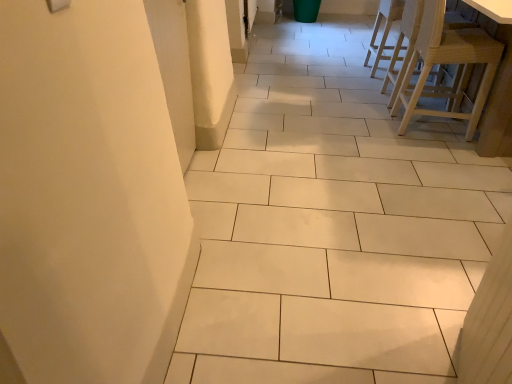
Question: From the image's perspective, is natural wood chair at upper right, the 2th chair when ordered from back to front, located above or below light wood chair at upper right, marked as the 3th chair in a front-to-back arrangement?

Choices:
 (A) below
 (B) above

Answer: (A)

Question: Is natural wood chair at upper right, acting as the second chair starting from the front, taller or shorter than light wood chair at upper right, marked as the 3th chair in a front-to-back arrangement?

Choices:
 (A) short
 (B) tall

Answer: (B)

Question: Estimate the real-world distances between objects in this image. Which object is closer to the light wood stool at right, positioned as the third chair in back-to-front order?

Choices:
 (A) light wood chair at upper right, marked as the 3th chair in a front-to-back arrangement
 (B) natural wood chair at upper right, acting as the second chair starting from the front

Answer: (B)

Question: Which object is the closest to the light wood stool at right, positioned as the third chair in back-to-front order?

Choices:
 (A) light wood chair at upper right, which is the first chair from back to front
 (B) natural wood chair at upper right, acting as the second chair starting from the front

Answer: (B)